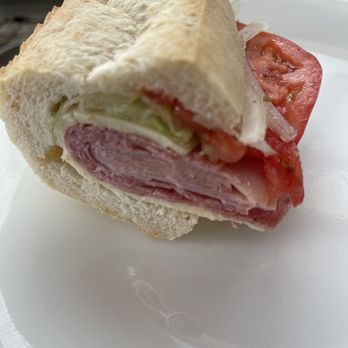
I want to click on plate, so click(192, 288).